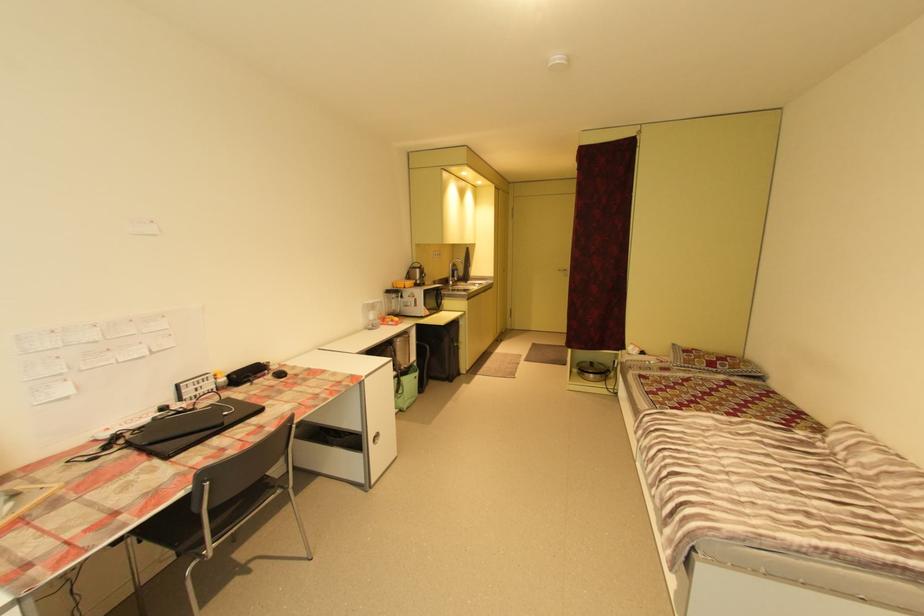
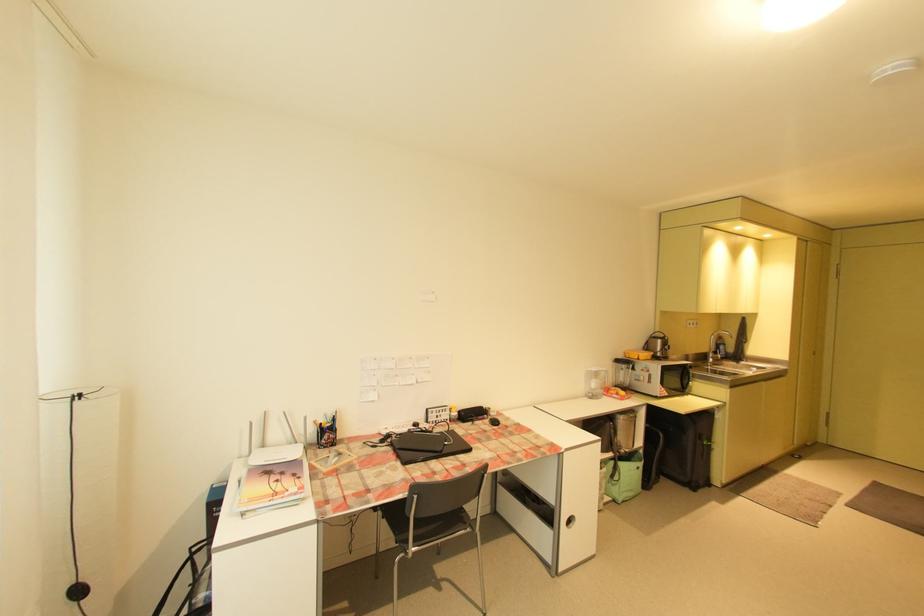
Find the pixel in the second image that matches [271,376] in the first image.

(491, 419)